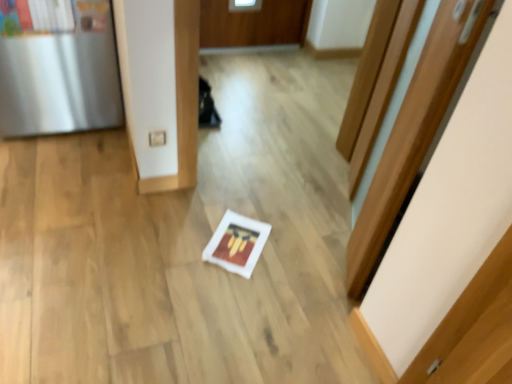
Identify the location of vacant space in front of wooden door at center. The width and height of the screenshot is (512, 384). (286, 308).